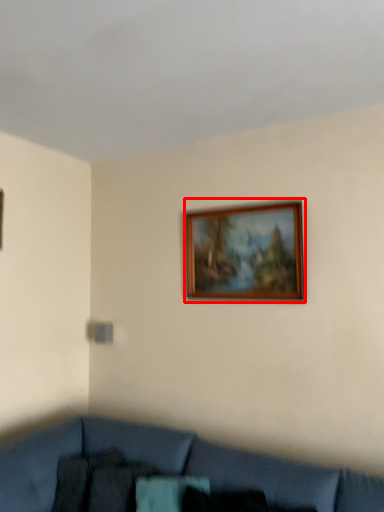
Question: From the image's perspective, considering the relative positions of picture frame (annotated by the red box) and studio couch in the image provided, where is picture frame (annotated by the red box) located with respect to the staircase?

Choices:
 (A) below
 (B) above

Answer: (B)